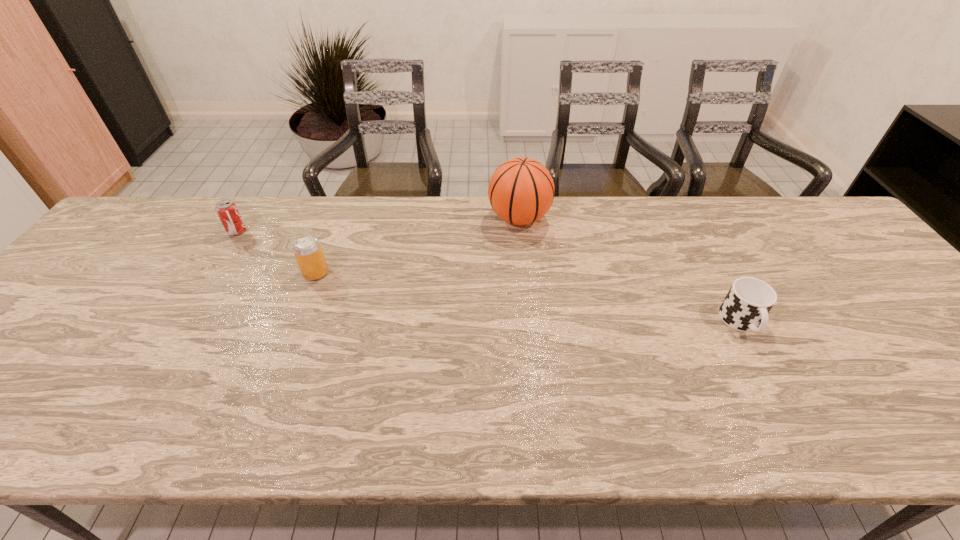
Locate an element on the screen. This screenshot has height=540, width=960. vacant region located on the left of the leftmost object is located at coordinates (187, 231).

Image resolution: width=960 pixels, height=540 pixels. I want to click on free spot located on the side of the cup with the handle, so click(769, 374).

Image resolution: width=960 pixels, height=540 pixels. What are the coordinates of `basketball that is at the far edge` in the screenshot? It's located at [x=521, y=191].

The height and width of the screenshot is (540, 960). Identify the location of soda can present at the far edge. (226, 209).

In the image, there is a desktop. At what (x,y) coordinates should I click in order to perform the action: click on vacant space at the far edge. Please return your answer as a coordinate pair (x, y). Looking at the image, I should click on (434, 234).

You are a GUI agent. You are given a task and a screenshot of the screen. Output one action in this format:
    pyautogui.click(x=<x>, y=<y>)
    Task: Click on the vacant area at the near edge
    This screenshot has width=960, height=540.
    Given the screenshot: What is the action you would take?
    pyautogui.click(x=753, y=435)

Locate an element on the screen. The image size is (960, 540). vacant space at the left edge of the desktop is located at coordinates (27, 351).

In the image, there is a desktop. Identify the location of vacant space at the far left corner. The width and height of the screenshot is (960, 540). (141, 205).

Locate an element on the screen. free spot between the leftmost object and the rightmost object is located at coordinates (490, 277).

Find the location of a particular element. blank region between the leftmost object and the cup is located at coordinates (490, 277).